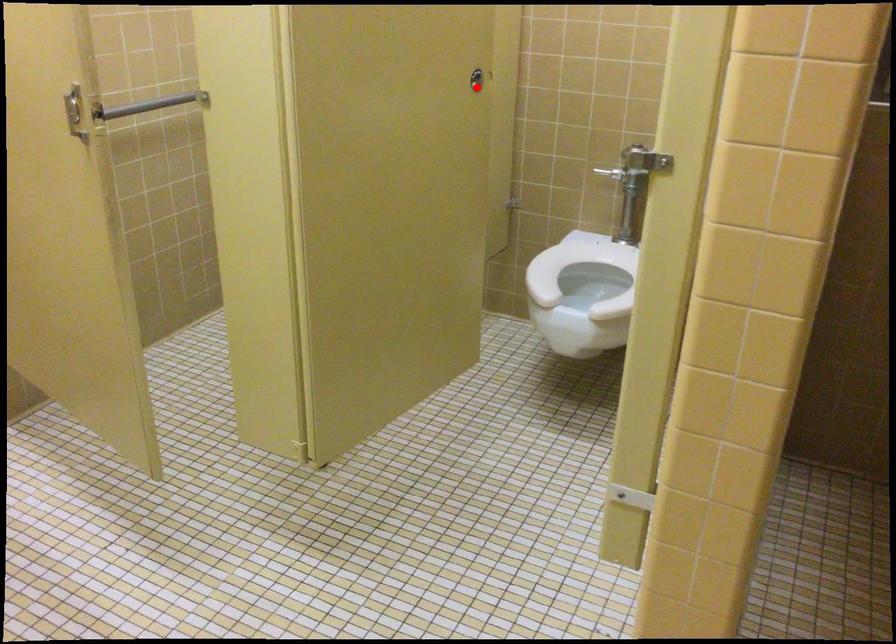
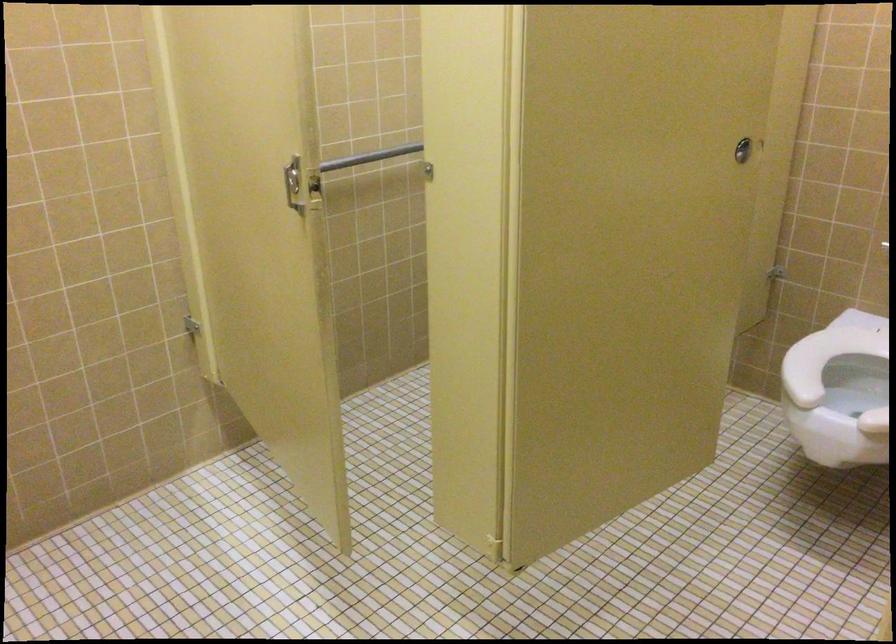
The point at the highlighted location is marked in the first image. Where is the corresponding point in the second image?

(743, 149)